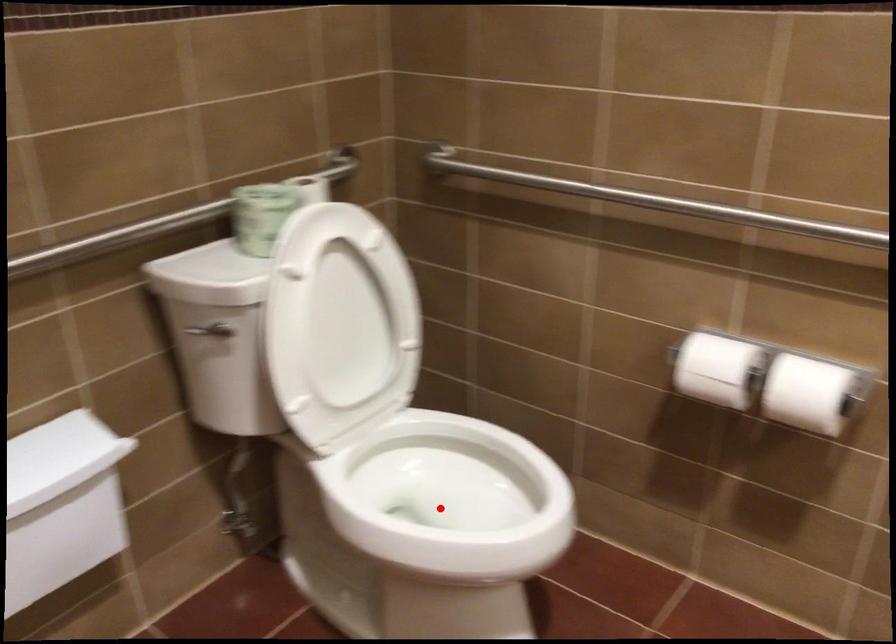
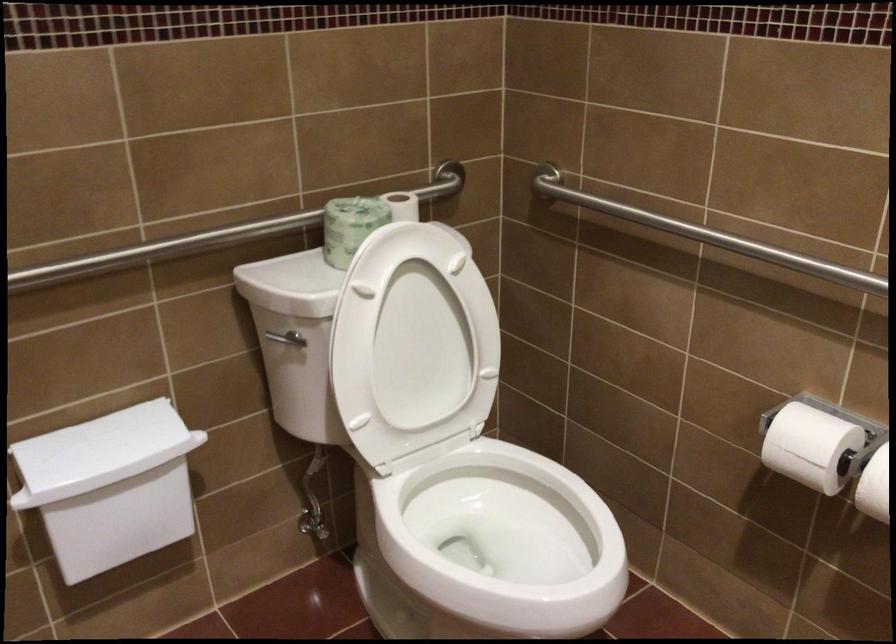
Question: I am providing you with two images of the same scene from different viewpoints. A red point is marked on the first image. Is the red point's position out of view in image 2?

Choices:
 (A) Yes
 (B) No

Answer: (B)